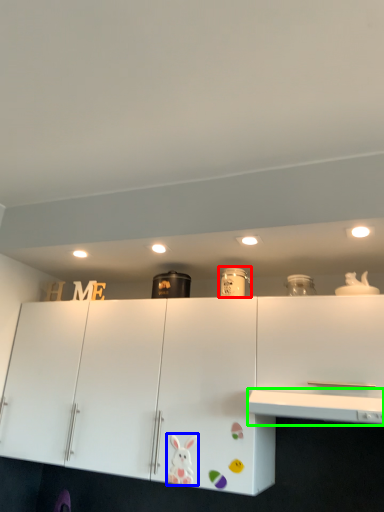
Question: Estimate the real-world distances between objects in this image. Which object is closer to appliance (highlighted by a red box), animal (highlighted by a blue box) or counter top (highlighted by a green box)?

Choices:
 (A) animal
 (B) counter top

Answer: (B)